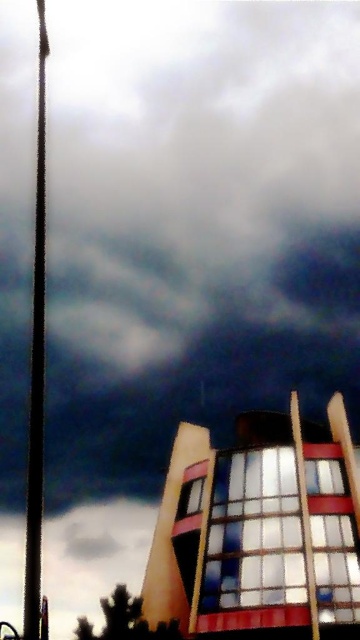
You are a GUI agent. You are given a task and a screenshot of the screen. Output one action in this format:
    pyautogui.click(x=<x>, y=<y>)
    Task: Click on the metallic pole at left
    This screenshot has width=360, height=640.
    Given the screenshot: What is the action you would take?
    pyautogui.click(x=37, y=374)

Between metallic pole at left and wooden flag pole at right, which one is positioned higher?

metallic pole at left

This screenshot has height=640, width=360. What do you see at coordinates (37, 374) in the screenshot? I see `metallic pole at left` at bounding box center [37, 374].

Locate an element on the screen. metallic pole at left is located at coordinates (37, 374).